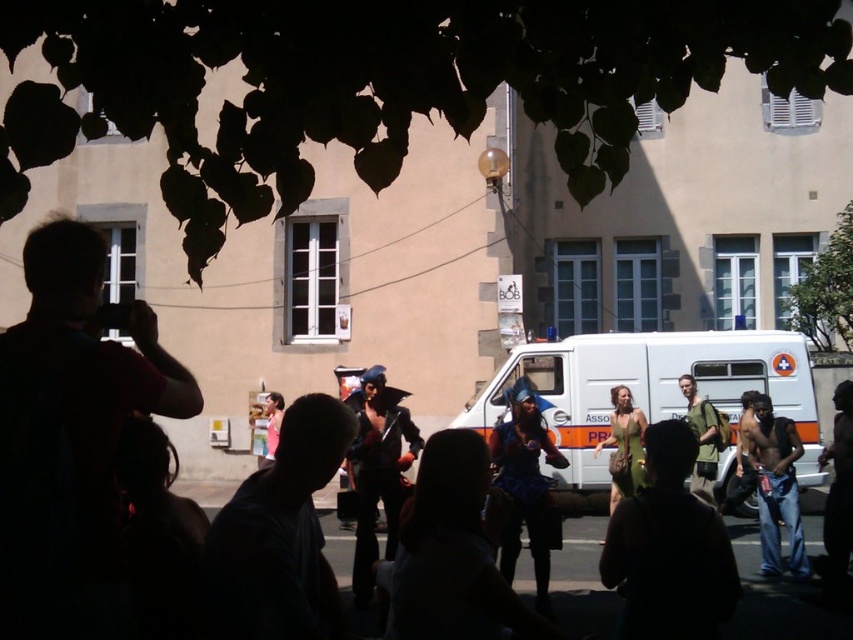
Question: Does green fabric backpack at right appear under pink fabric dress at center?

Choices:
 (A) no
 (B) yes

Answer: (A)

Question: Can you confirm if shiny black costume at center is wider than denim jeans at lower right?

Choices:
 (A) no
 (B) yes

Answer: (A)

Question: Which object is farther from the camera taking this photo?

Choices:
 (A) shiny black costume at center
 (B) denim jeans at lower right

Answer: (B)

Question: Estimate the real-world distances between objects in this image. Which object is farther from the denim jeans at lower right?

Choices:
 (A) white matte van at center
 (B) green fabric backpack at right
 (C) shiny blue costume at center
 (D) pink fabric dress at center

Answer: (D)

Question: Can you confirm if denim jeans at lower right is wider than green fabric backpack at right?

Choices:
 (A) yes
 (B) no

Answer: (A)

Question: Which of the following is the farthest from the observer?

Choices:
 (A) shiny blue costume at center
 (B) pink fabric dress at center

Answer: (B)